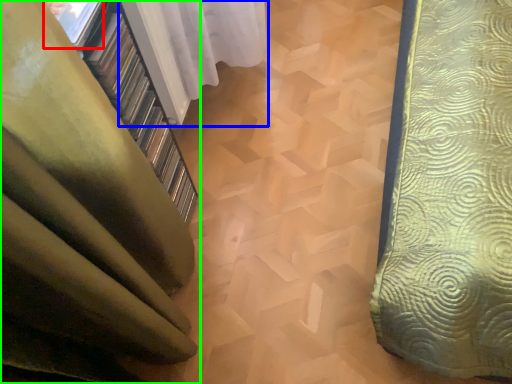
Question: Which object is positioned closest to window (highlighted by a red box)? Select from curtain (highlighted by a blue box) and curtain (highlighted by a green box).

Choices:
 (A) curtain
 (B) curtain

Answer: (B)